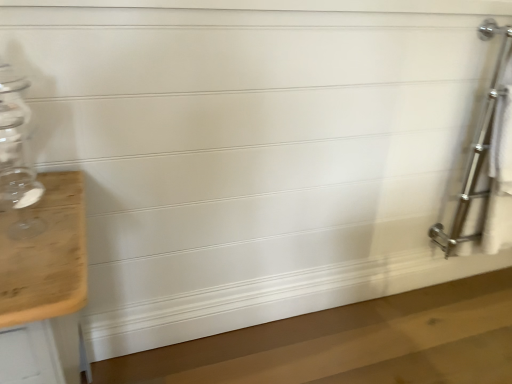
Question: Is polished chrome towel rack at right inside or outside of transparent glass jar at left?

Choices:
 (A) outside
 (B) inside

Answer: (A)

Question: Is polished chrome towel rack at right in front of or behind transparent glass jar at left in the image?

Choices:
 (A) front
 (B) behind

Answer: (B)

Question: Considering the positions of point (441, 241) and point (2, 150), is point (441, 241) closer or farther from the camera than point (2, 150)?

Choices:
 (A) closer
 (B) farther

Answer: (B)

Question: Is transparent glass jar at left situated inside polished chrome towel rack at right or outside?

Choices:
 (A) outside
 (B) inside

Answer: (A)

Question: Relative to polished chrome towel rack at right, is transparent glass jar at left in front or behind?

Choices:
 (A) front
 (B) behind

Answer: (A)

Question: Looking at their shapes, would you say transparent glass jar at left is wider or thinner than polished chrome towel rack at right?

Choices:
 (A) thin
 (B) wide

Answer: (B)

Question: From the image's perspective, is transparent glass jar at left positioned above or below polished chrome towel rack at right?

Choices:
 (A) below
 (B) above

Answer: (A)